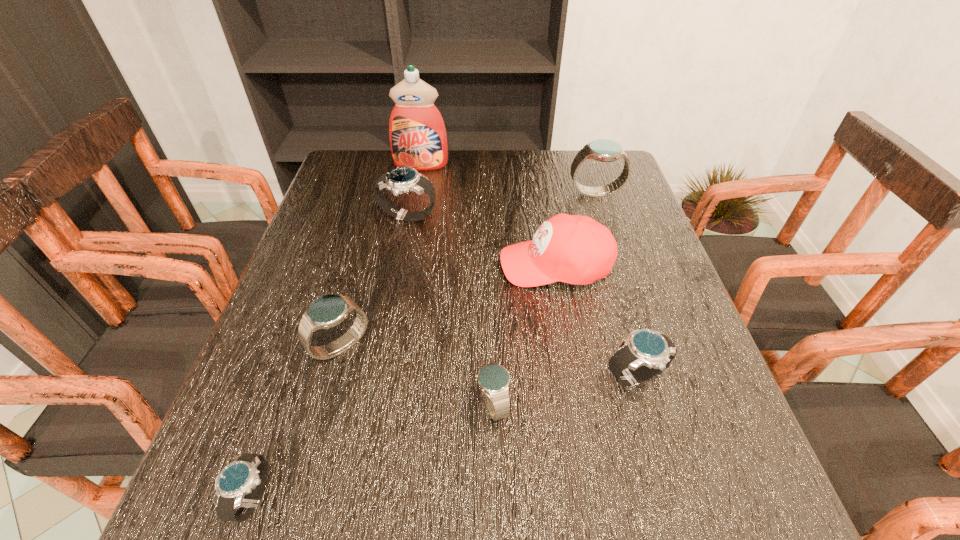
This screenshot has width=960, height=540. In order to click on free space located 0.110m on the front panel of the baseball cap in this screenshot , I will do `click(452, 265)`.

You are a GUI agent. You are given a task and a screenshot of the screen. Output one action in this format:
    pyautogui.click(x=<x>, y=<y>)
    Task: Click on the free space located on the front of the second nearest blue watch
    
    Given the screenshot: What is the action you would take?
    pyautogui.click(x=296, y=509)

The image size is (960, 540). Find the location of `free space located 0.120m on the left of the rightmost silver watch`. free space located 0.120m on the left of the rightmost silver watch is located at coordinates (537, 377).

Find the location of a particular element. This screenshot has height=540, width=960. vacant space located 0.100m on the back of the third watch from right to left is located at coordinates (491, 336).

Locate an element on the screen. The width and height of the screenshot is (960, 540). blank space located on the right of the nearest object is located at coordinates (396, 497).

Locate an element on the screen. This screenshot has height=540, width=960. detergent that is at the far edge is located at coordinates (418, 139).

You are a GUI agent. You are given a task and a screenshot of the screen. Output one action in this format:
    pyautogui.click(x=<x>, y=<y>)
    Task: Click on the watch situated at the far edge
    This screenshot has width=960, height=540.
    Given the screenshot: What is the action you would take?
    pyautogui.click(x=603, y=150)

In order to click on object that is at the near edge in this screenshot , I will do `click(246, 474)`.

You are a GUI agent. You are given a task and a screenshot of the screen. Output one action in this format:
    pyautogui.click(x=<x>, y=<y>)
    Task: Click on the baseball cap located at the right edge
    This screenshot has height=540, width=960.
    Given the screenshot: What is the action you would take?
    pyautogui.click(x=575, y=249)

Find the location of a particular element. object that is at the near left corner is located at coordinates (246, 474).